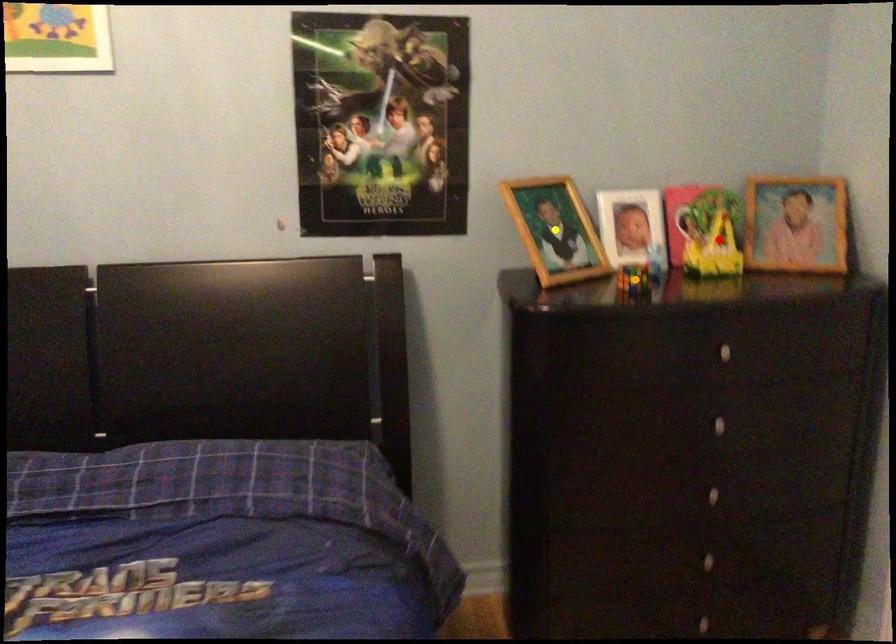
Order these from nearest to farthest:
orange point | red point | yellow point

orange point < yellow point < red point